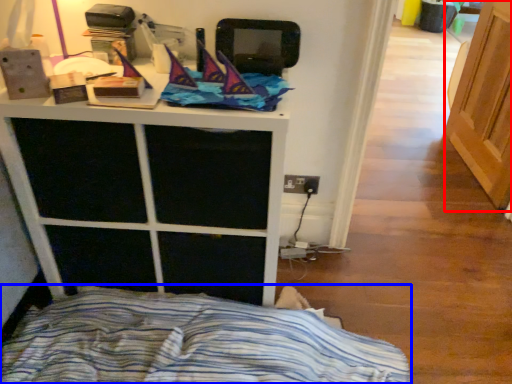
Question: Which point is further to the camera, screen door (highlighted by a red box) or bed (highlighted by a blue box)?

Choices:
 (A) screen door
 (B) bed

Answer: (A)